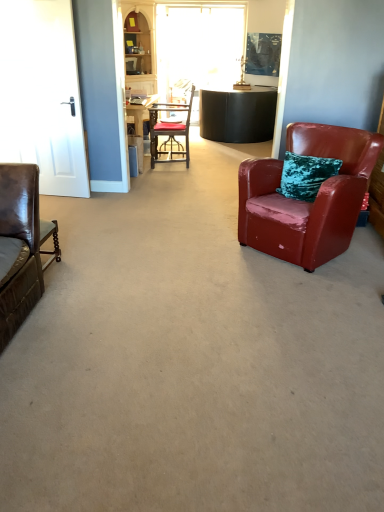
Question: Considering the relative sizes of wooden cabinet at upper left and matte black chair at center, arranged as the 2th chair when viewed from the right, in the image provided, is wooden cabinet at upper left bigger than matte black chair at center, arranged as the 2th chair when viewed from the right,?

Choices:
 (A) yes
 (B) no

Answer: (A)

Question: Can you confirm if wooden cabinet at upper left is smaller than matte black chair at center, the first chair in the back-to-front sequence?

Choices:
 (A) yes
 (B) no

Answer: (B)

Question: Is wooden cabinet at upper left next to matte black chair at center, which is the second chair from bottom to top, and touching it?

Choices:
 (A) no
 (B) yes

Answer: (A)

Question: Is wooden cabinet at upper left shorter than matte black chair at center, the 1th chair viewed from the top?

Choices:
 (A) no
 (B) yes

Answer: (A)

Question: From a real-world perspective, does wooden cabinet at upper left sit lower than matte black chair at center, arranged as the 2th chair when viewed from the right?

Choices:
 (A) yes
 (B) no

Answer: (B)

Question: Looking at their shapes, would you say matte black chair at center, which is the second chair from bottom to top, is wider or thinner than shiny red leather armchair at right, arranged as the 1th chair when viewed from the right?

Choices:
 (A) wide
 (B) thin

Answer: (B)

Question: Would you say matte black chair at center, the 1th chair viewed from the top, is to the left or to the right of shiny red leather armchair at right, placed as the 2th chair when sorted from left to right, in the picture?

Choices:
 (A) left
 (B) right

Answer: (A)

Question: Relative to shiny red leather armchair at right, marked as the second chair in a top-to-bottom arrangement, is matte black chair at center, arranged as the 2th chair when viewed from the right, in front or behind?

Choices:
 (A) behind
 (B) front

Answer: (A)

Question: From the image's perspective, is matte black chair at center, which is the first chair in left-to-right order, positioned above or below shiny red leather armchair at right, which is the first chair in bottom-to-top order?

Choices:
 (A) below
 (B) above

Answer: (B)

Question: Is wooden cabinet at upper left situated inside shiny red leather armchair at right, which is the first chair in bottom-to-top order, or outside?

Choices:
 (A) outside
 (B) inside

Answer: (A)

Question: Considering their positions, is wooden cabinet at upper left located in front of or behind shiny red leather armchair at right, marked as the second chair in a top-to-bottom arrangement?

Choices:
 (A) behind
 (B) front

Answer: (A)

Question: From the image's perspective, is wooden cabinet at upper left located above or below shiny red leather armchair at right, arranged as the 1th chair when viewed from the right?

Choices:
 (A) below
 (B) above

Answer: (B)

Question: From a real-world perspective, is wooden cabinet at upper left physically located above or below shiny red leather armchair at right, arranged as the 1th chair when viewed from the right?

Choices:
 (A) above
 (B) below

Answer: (A)

Question: Which is correct: white glossy door at left is inside matte black chair at center, arranged as the 2th chair when viewed from the right, or outside of it?

Choices:
 (A) outside
 (B) inside

Answer: (A)

Question: Visually, is white glossy door at left positioned to the left or to the right of matte black chair at center, the 1th chair viewed from the top?

Choices:
 (A) left
 (B) right

Answer: (A)